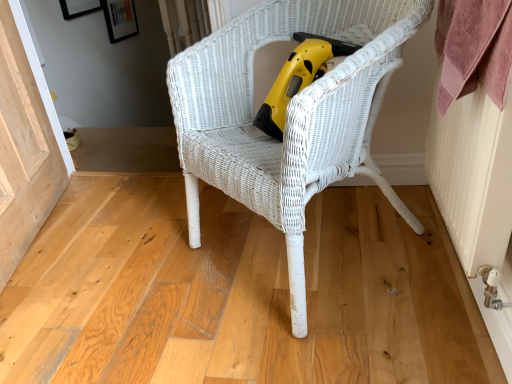
I want to click on free space in front of natural wood screen door at lower left, so click(54, 310).